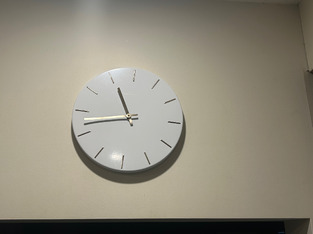
Where is `doorframe`? The image size is (313, 234). doorframe is located at coordinates (253, 221).